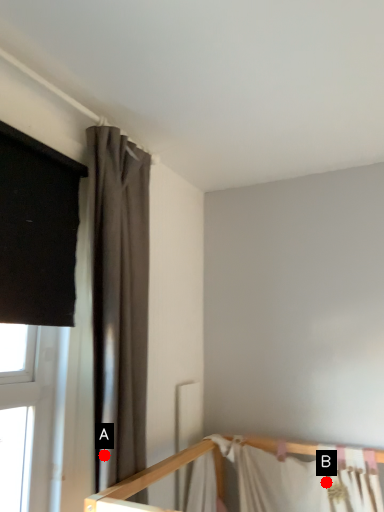
Question: Two points are circled on the image, labeled by A and B beside each circle. Which point appears closest to the camera in this image?

Choices:
 (A) A is closer
 (B) B is closer

Answer: (A)